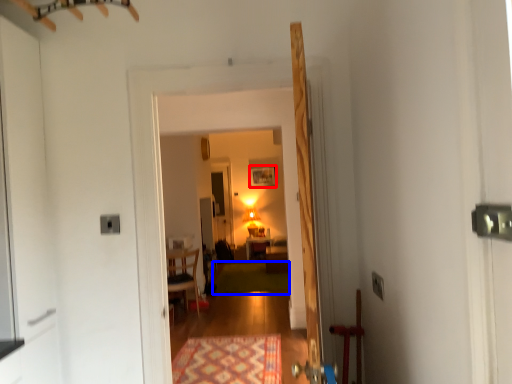
Question: Which point is further to the camera, painting (highlighted by a red box) or mat (highlighted by a blue box)?

Choices:
 (A) painting
 (B) mat

Answer: (A)